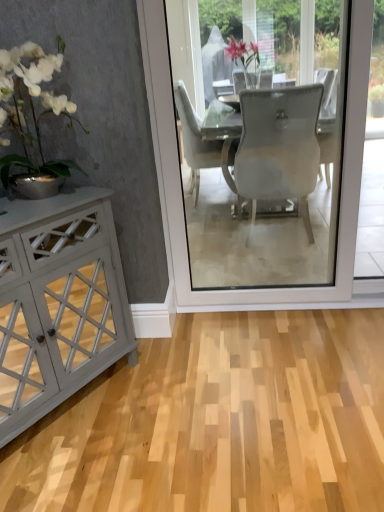
What are the coordinates of `free point below matte gray cabinet at left (from a real-world perspective)` in the screenshot? It's located at (67, 410).